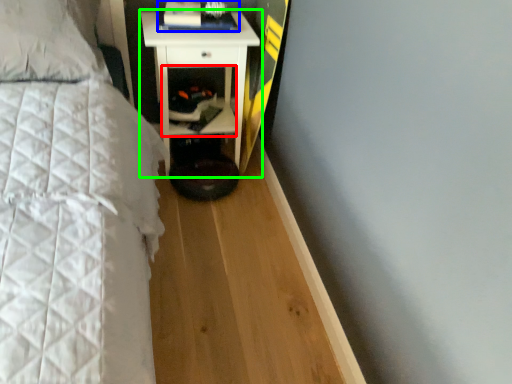
Question: Considering the real-world distances, which object is closest to cabinet (highlighted by a red box)? book (highlighted by a blue box) or nightstand (highlighted by a green box).

Choices:
 (A) book
 (B) nightstand

Answer: (B)